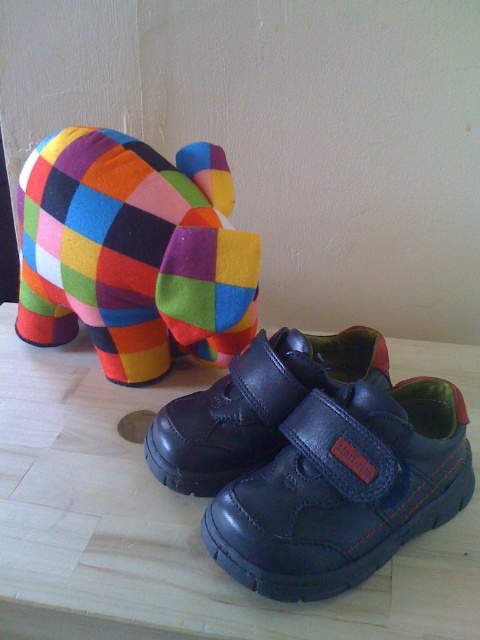
Question: Estimate the real-world distances between objects in this image. Which object is farther from the shiny black leather shoe at center?

Choices:
 (A) black leather shoe at lower center
 (B) multicolored felt elephant at upper left

Answer: (B)

Question: Which of the following is the farthest from the observer?

Choices:
 (A) (363, 364)
 (B) (35, 164)

Answer: (A)

Question: Where is multicolored felt elephant at upper left located in relation to black leather shoe at lower center in the image?

Choices:
 (A) above
 (B) below

Answer: (A)

Question: Among these points, which one is farthest from the camera?

Choices:
 (A) (94, 228)
 (B) (447, 458)
 (C) (206, 451)

Answer: (A)

Question: Is multicolored felt elephant at upper left above shiny black leather shoe at center?

Choices:
 (A) yes
 (B) no

Answer: (A)

Question: From the image, what is the correct spatial relationship of shiny black leather shoe at center in relation to black leather shoe at lower center?

Choices:
 (A) left
 (B) right

Answer: (B)